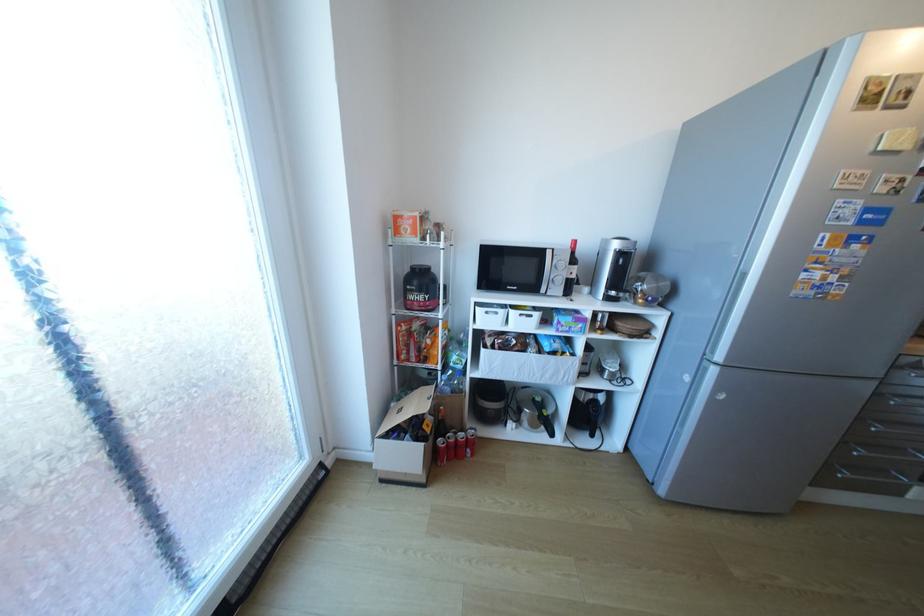
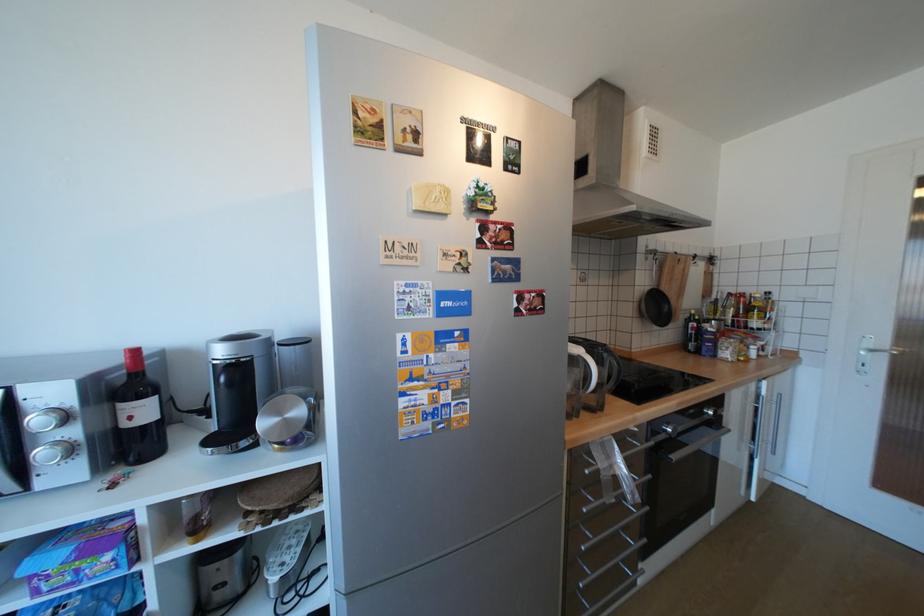
Find the pixel in the second image that matches point (576, 329) in the first image.

(79, 578)